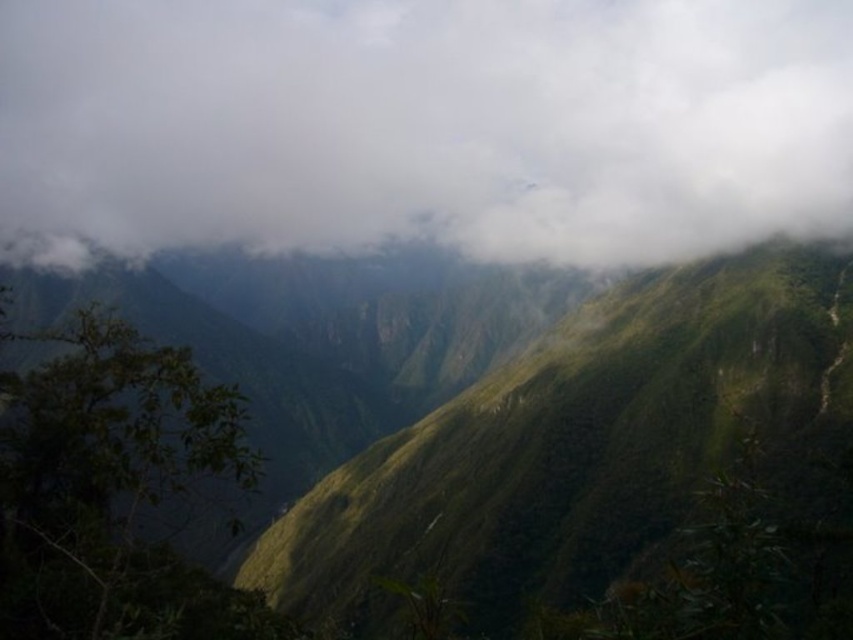
Between point (729, 157) and point (350, 602), which one is positioned in front?

Point (350, 602)

Measure the distance between white fluffy cloud at upper center and green grassy hillside at center.

white fluffy cloud at upper center and green grassy hillside at center are 191.40 meters apart from each other.

Where is `white fluffy cloud at upper center`? white fluffy cloud at upper center is located at coordinates (422, 125).